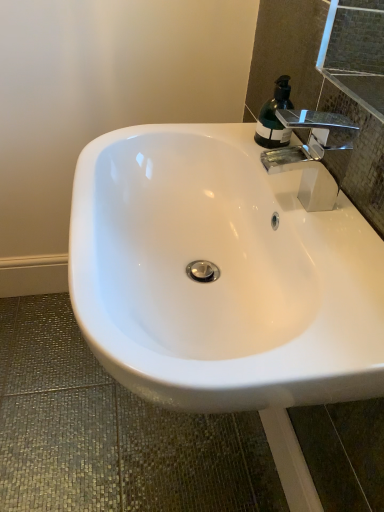
Measure the distance between point (279, 94) and camera.

They are 37.40 inches apart.

Image resolution: width=384 pixels, height=512 pixels. What do you see at coordinates (221, 275) in the screenshot? I see `white glossy sink at center` at bounding box center [221, 275].

Describe the element at coordinates (315, 155) in the screenshot. This screenshot has height=512, width=384. I see `chrome/metallic faucet at upper right` at that location.

In order to click on translucent green bottle at upper right in this screenshot , I will do `click(274, 117)`.

Is chrome/metallic faucet at upper right positioned beyond the bounds of translucent green bottle at upper right?

That's correct, chrome/metallic faucet at upper right is outside of translucent green bottle at upper right.

In the scene shown: Is chrome/metallic faucet at upper right facing towards translucent green bottle at upper right?

No, chrome/metallic faucet at upper right is not oriented towards translucent green bottle at upper right.

From a real-world perspective, is chrome/metallic faucet at upper right below translucent green bottle at upper right?

No.

Can you see chrome/metallic faucet at upper right touching translucent green bottle at upper right?

Absolutely, chrome/metallic faucet at upper right is next to and touching translucent green bottle at upper right.

Does white glossy sink at center turn towards chrome/metallic faucet at upper right?

No, white glossy sink at center is not turned towards chrome/metallic faucet at upper right.

Looking at this image, can you confirm if white glossy sink at center is shorter than chrome/metallic faucet at upper right?

In fact, white glossy sink at center may be taller than chrome/metallic faucet at upper right.

Between white glossy sink at center and chrome/metallic faucet at upper right, which one is positioned behind?

chrome/metallic faucet at upper right is further from the camera.

Which point is more forward, (174, 246) or (315, 158)?

Positioned in front is point (315, 158).

Is white glossy sink at center inside chrome/metallic faucet at upper right?

That's incorrect, white glossy sink at center is not inside chrome/metallic faucet at upper right.

Which is in front, point (334, 165) or point (90, 209)?

The point (90, 209) is closer to the camera.

Which of these two, chrome/metallic faucet at upper right or white glossy sink at center, stands shorter?

chrome/metallic faucet at upper right.

Could you tell me if translucent green bottle at upper right is turned towards chrome/metallic faucet at upper right?

No, translucent green bottle at upper right does not turn towards chrome/metallic faucet at upper right.

Would you say translucent green bottle at upper right is outside chrome/metallic faucet at upper right?

Yes, translucent green bottle at upper right is located beyond the bounds of chrome/metallic faucet at upper right.

Is translucent green bottle at upper right closer to the viewer compared to chrome/metallic faucet at upper right?

No, it is behind chrome/metallic faucet at upper right.

From a real-world perspective, which object rests below the other?

translucent green bottle at upper right is physically lower.

Is white glossy sink at center wider than translucent green bottle at upper right?

Yes, white glossy sink at center is wider than translucent green bottle at upper right.

From a real-world perspective, relative to translucent green bottle at upper right, is white glossy sink at center vertically above or below?

In terms of real-world spatial position, white glossy sink at center is below translucent green bottle at upper right.

Could you tell me if white glossy sink at center is facing translucent green bottle at upper right?

No, white glossy sink at center is not turned towards translucent green bottle at upper right.

Relative to white glossy sink at center, is translucent green bottle at upper right in front or behind?

translucent green bottle at upper right is behind white glossy sink at center.

Based on the photo, which of these two, translucent green bottle at upper right or white glossy sink at center, is smaller?

Smaller between the two is translucent green bottle at upper right.

Could you tell me if translucent green bottle at upper right is facing white glossy sink at center?

No, translucent green bottle at upper right is not facing towards white glossy sink at center.

Considering the relative sizes of translucent green bottle at upper right and white glossy sink at center in the image provided, is translucent green bottle at upper right thinner than white glossy sink at center?

Indeed, translucent green bottle at upper right has a lesser width compared to white glossy sink at center.

Locate an element on the screen. The image size is (384, 512). tap that is on the right side of translucent green bottle at upper right is located at coordinates (315, 155).

The width and height of the screenshot is (384, 512). Find the location of `tap positioned vertically above the white glossy sink at center (from a real-world perspective)`. tap positioned vertically above the white glossy sink at center (from a real-world perspective) is located at coordinates (315, 155).

From the image, which object appears to be nearer to translucent green bottle at upper right, white glossy sink at center or chrome/metallic faucet at upper right?

chrome/metallic faucet at upper right is positioned closer to the anchor translucent green bottle at upper right.

Which object lies further to the anchor point translucent green bottle at upper right, chrome/metallic faucet at upper right or white glossy sink at center?

The object further to translucent green bottle at upper right is white glossy sink at center.

From the image, which object appears to be nearer to white glossy sink at center, translucent green bottle at upper right or chrome/metallic faucet at upper right?

The object closer to white glossy sink at center is chrome/metallic faucet at upper right.

Based on their spatial positions, is white glossy sink at center or translucent green bottle at upper right closer to chrome/metallic faucet at upper right?

translucent green bottle at upper right.

Estimate the real-world distances between objects in this image. Which object is closer to white glossy sink at center, chrome/metallic faucet at upper right or translucent green bottle at upper right?

chrome/metallic faucet at upper right.

Which object lies nearer to the anchor point chrome/metallic faucet at upper right, translucent green bottle at upper right or white glossy sink at center?

Based on the image, translucent green bottle at upper right appears to be nearer to chrome/metallic faucet at upper right.

The image size is (384, 512). I want to click on tap between translucent green bottle at upper right and white glossy sink at center in the up-down direction, so click(315, 155).